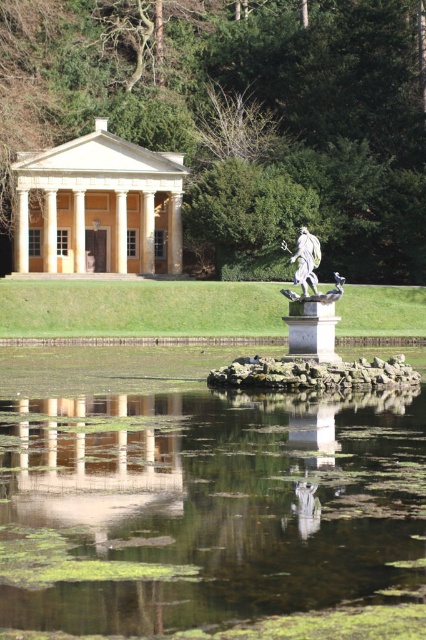
Question: Can you confirm if green algae water at center is positioned to the right of white marble statue at center?

Choices:
 (A) no
 (B) yes

Answer: (A)

Question: Does beige stone palace at upper left have a lesser width compared to white marble statue at center?

Choices:
 (A) yes
 (B) no

Answer: (B)

Question: Which point is farther to the camera?

Choices:
 (A) green algae water at center
 (B) beige stone palace at upper left

Answer: (B)

Question: Considering the relative positions of green algae water at center and beige stone palace at upper left in the image provided, where is green algae water at center located with respect to beige stone palace at upper left?

Choices:
 (A) left
 (B) right

Answer: (B)

Question: Which of the following is the closest to the observer?

Choices:
 (A) green algae water at center
 (B) beige stone palace at upper left

Answer: (A)

Question: Which of the following is the closest to the observer?

Choices:
 (A) (253, 548)
 (B) (23, 180)
 (C) (291, 296)

Answer: (A)